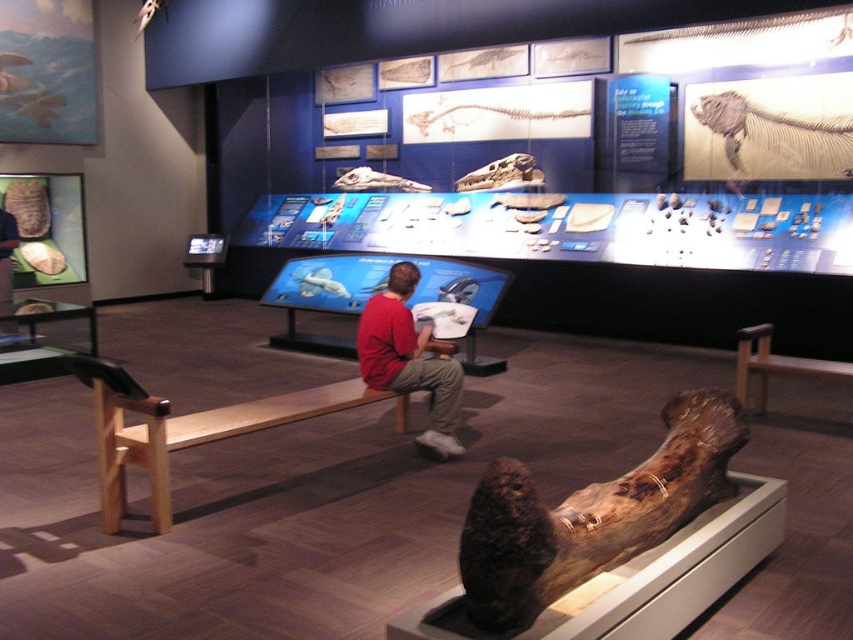
Question: Estimate the real-world distances between objects in this image. Which object is closer to the red cotton shirt at center?

Choices:
 (A) brown wood log at lower right
 (B) light brown wood bench at center

Answer: (B)

Question: Which of the following is the farthest from the observer?

Choices:
 (A) [x=160, y=506]
 (B) [x=422, y=372]
 (C) [x=621, y=509]

Answer: (B)

Question: Which point is farther to the camera?

Choices:
 (A) light brown wood bench at center
 (B) brown wood log at lower right

Answer: (A)

Question: Can you confirm if brown wood log at lower right is positioned below light brown wood bench at center?

Choices:
 (A) yes
 (B) no

Answer: (B)

Question: Can you confirm if brown wood log at lower right is thinner than red cotton shirt at center?

Choices:
 (A) yes
 (B) no

Answer: (B)

Question: Can you confirm if brown wood log at lower right is positioned above light brown wood bench at center?

Choices:
 (A) yes
 (B) no

Answer: (A)